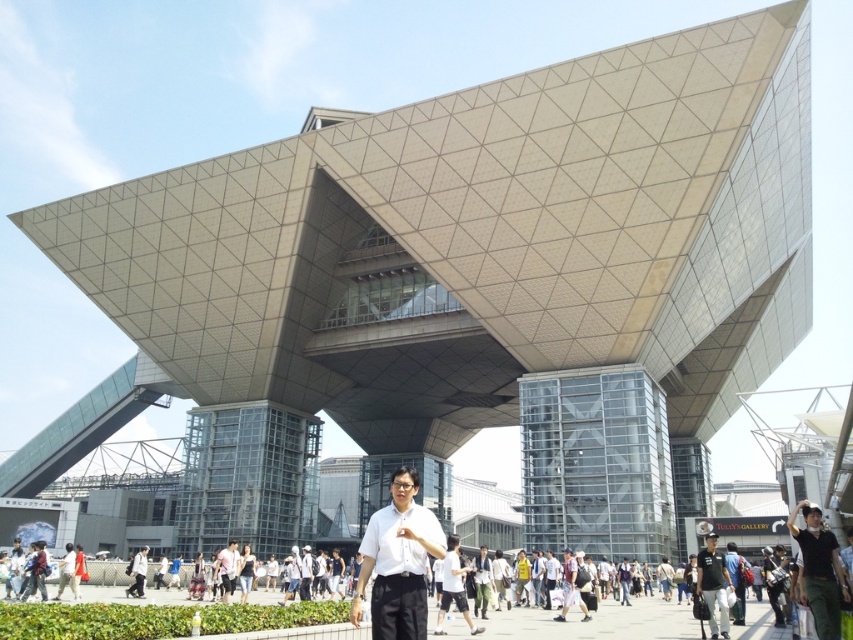
Question: Is white matte shirt at center positioned before black cotton shirt at center?

Choices:
 (A) no
 (B) yes

Answer: (B)

Question: Which object is closer to the camera taking this photo?

Choices:
 (A) black cotton shirt at center
 (B) green fabric pants at lower right

Answer: (B)

Question: Is green fabric pants at lower right further to the viewer compared to white shirt at center?

Choices:
 (A) no
 (B) yes

Answer: (A)

Question: Does green fabric pants at lower right appear on the right side of black cotton shirt at center?

Choices:
 (A) yes
 (B) no

Answer: (B)

Question: Which object appears farthest from the camera in this image?

Choices:
 (A) green fabric pants at lower right
 (B) white matte shirt at center
 (C) black cotton shirt at center
 (D) white shirt at center

Answer: (D)

Question: Estimate the real-world distances between objects in this image. Which object is closer to the white matte shirt at center?

Choices:
 (A) black cotton shirt at center
 (B) white shirt at center

Answer: (A)